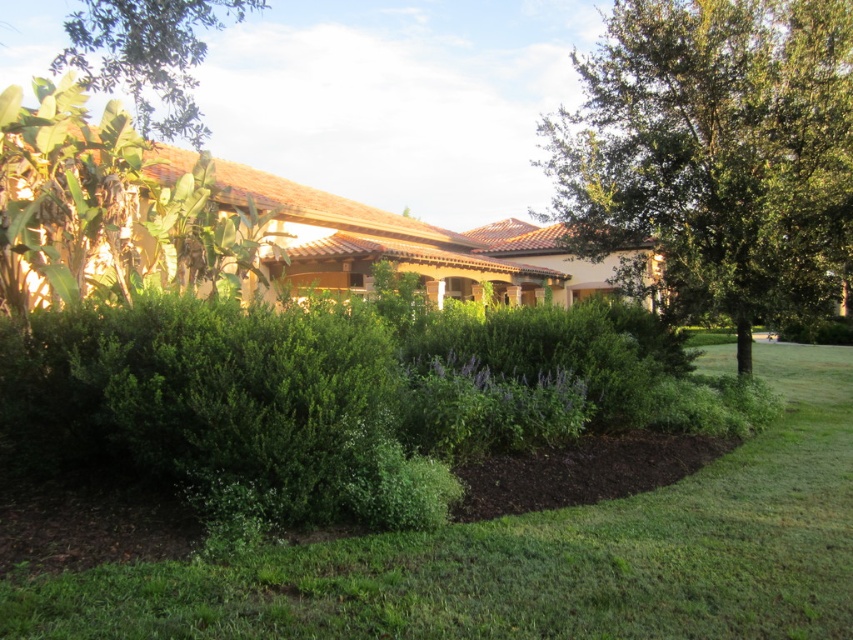
You are a gardener planning to plant a new flower bed. You have two areas in mind based on the image provided. The first area is where the green grass at lower center is located, and the second is near the green leafy tree at upper left. Considering the size of these areas, which location would you choose for a flower bed that requires more space?

The green leafy tree at upper left area is larger in size compared to the green grass at lower center, so the flower bed requiring more space should be placed near the green leafy tree at upper left.

You are a gardener who needs to water the green grass at lower center and the green leafy tree at upper left. Your hose can only reach up to 40 meters. Can you water both plants without moving the hose? Please explain your reasoning.

The distance between the green grass at lower center and the green leafy tree at upper left is 41.63 meters. Since the hose can only reach up to 40 meters, you cannot water both plants without moving the hose because the distance exceeds the hose length.

You are standing in the garden and want to take a photo of the green grass at lower center and the green leafy tree at upper left. Which object will appear closer to the camera in the photo?

The green grass at lower center will appear closer to the camera because it is in front of the green leafy tree at upper left.